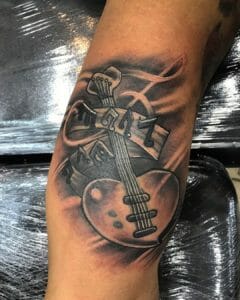
Where is `knob`? knob is located at coordinates (116, 225), (110, 213), (99, 193).